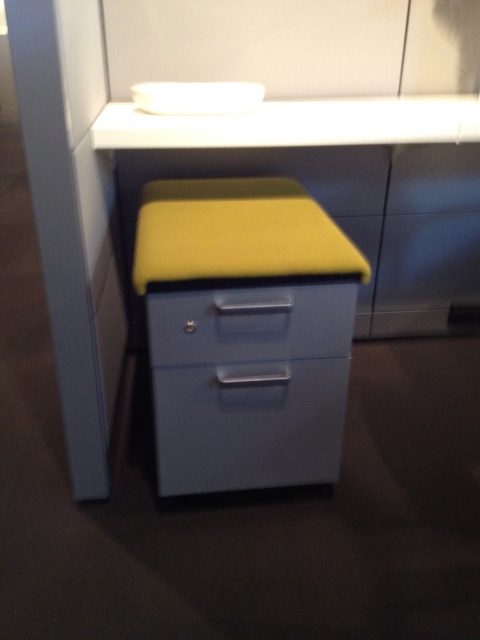
Who is shorter, white glossy counter top at upper center or matte blue drawer at center?

With less height is matte blue drawer at center.

Consider the image. Between white glossy counter top at upper center and matte blue drawer at center, which one is positioned lower?

matte blue drawer at center is lower down.

Image resolution: width=480 pixels, height=640 pixels. Describe the element at coordinates (296, 124) in the screenshot. I see `white glossy counter top at upper center` at that location.

Where is `white glossy counter top at upper center`? Image resolution: width=480 pixels, height=640 pixels. white glossy counter top at upper center is located at coordinates (296, 124).

Can you confirm if yellow fabric drawer at center is positioned to the left of matte blue drawer at center?

Indeed, yellow fabric drawer at center is positioned on the left side of matte blue drawer at center.

The height and width of the screenshot is (640, 480). Identify the location of yellow fabric drawer at center. (244, 332).

Locate an element on the screen. The height and width of the screenshot is (640, 480). yellow fabric drawer at center is located at coordinates (244, 332).

Is matte gray drawer at center wider than matte blue drawer at center?

No.

The height and width of the screenshot is (640, 480). In order to click on matte gray drawer at center in this screenshot , I will do `click(249, 424)`.

Identify the location of matte gray drawer at center. The width and height of the screenshot is (480, 640). (249, 424).